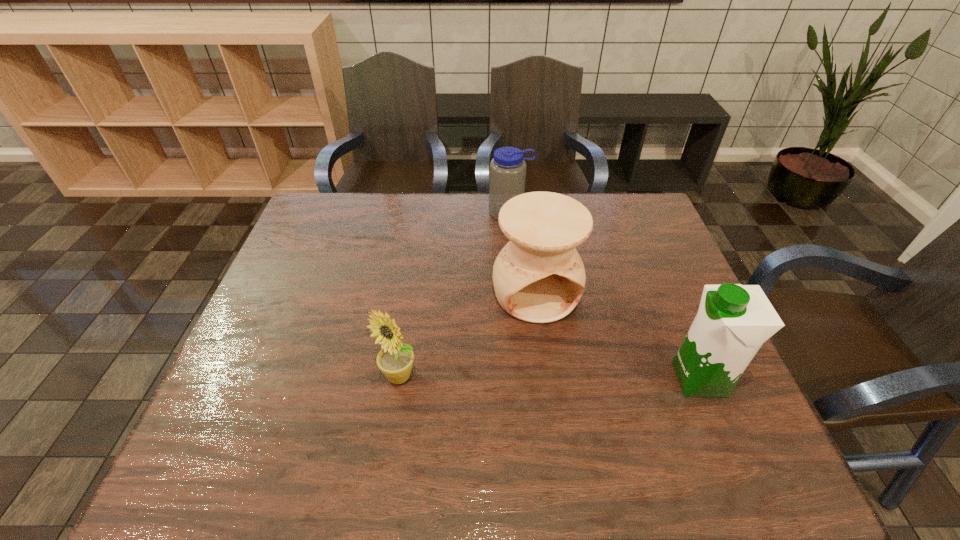
At what (x,y) coordinates should I click in order to perform the action: click on vacant area situated with a carrying loop on the side of the farthest object. Please return your answer as a coordinate pair (x, y). Looking at the image, I should click on (518, 249).

At what (x,y) coordinates should I click in order to perform the action: click on free space located 0.130m at the open side of the pottery. Please return your answer as a coordinate pair (x, y). Image resolution: width=960 pixels, height=540 pixels. Looking at the image, I should click on (569, 367).

You are a GUI agent. You are given a task and a screenshot of the screen. Output one action in this format:
    pyautogui.click(x=<x>, y=<y>)
    Task: Click on the free space located at the open side of the pottery
    
    Given the screenshot: What is the action you would take?
    pyautogui.click(x=595, y=426)

What are the coordinates of `vacant space located 0.180m at the open side of the pottery` in the screenshot? It's located at (577, 385).

Where is `object that is at the far edge`? The height and width of the screenshot is (540, 960). object that is at the far edge is located at coordinates (507, 170).

Identify the location of sunflower present at the near edge. This screenshot has height=540, width=960. (395, 360).

At what (x,y) coordinates should I click in order to perform the action: click on soya milk at the near edge. Please return your answer as a coordinate pair (x, y). The height and width of the screenshot is (540, 960). Looking at the image, I should click on (733, 321).

You are a GUI agent. You are given a task and a screenshot of the screen. Output one action in this format:
    pyautogui.click(x=<x>, y=<y>)
    Task: Click on the object that is at the right edge
    The width and height of the screenshot is (960, 540).
    Given the screenshot: What is the action you would take?
    pyautogui.click(x=733, y=321)

This screenshot has height=540, width=960. I want to click on object located at the near right corner, so click(x=733, y=321).

The height and width of the screenshot is (540, 960). Find the location of `vacant space at the far edge`. vacant space at the far edge is located at coordinates (487, 220).